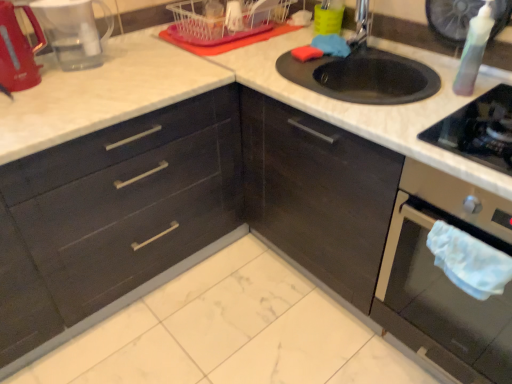
The image size is (512, 384). What are the coordinates of `vacant area that is in front of red plastic coffee maker at upper left` in the screenshot? It's located at (76, 85).